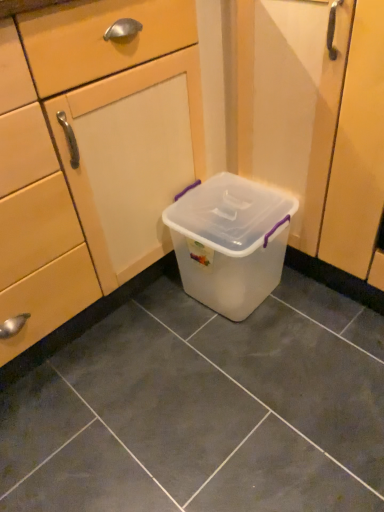
Question: Considering the positions of transparent plastic container at center and translucent plastic container at center in the image, is transparent plastic container at center bigger or smaller than translucent plastic container at center?

Choices:
 (A) small
 (B) big

Answer: (B)

Question: Considering their positions, is transparent plastic container at center located in front of or behind translucent plastic container at center?

Choices:
 (A) front
 (B) behind

Answer: (A)

Question: Considering the real-world distances, which object is closest to the transparent plastic storage box at center?

Choices:
 (A) transparent plastic container at center
 (B) translucent plastic container at center

Answer: (A)

Question: Which object is the closest to the transparent plastic storage box at center?

Choices:
 (A) transparent plastic container at center
 (B) translucent plastic container at center

Answer: (A)